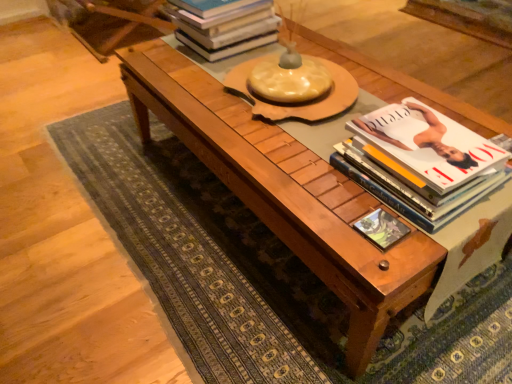
Where is `free space in front of matte green book at center`? The image size is (512, 384). free space in front of matte green book at center is located at coordinates (385, 265).